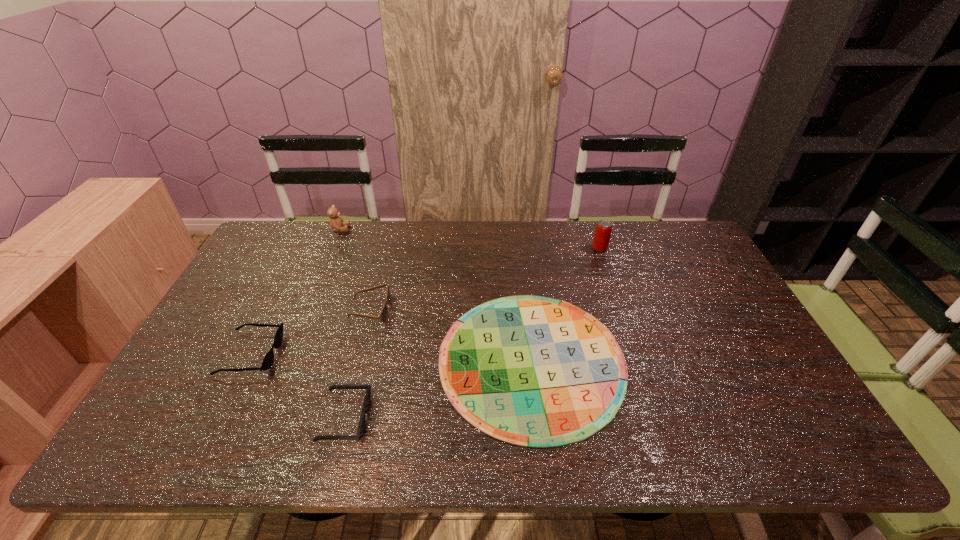
The image size is (960, 540). I want to click on blank area located on the right of the second farthest object, so click(668, 248).

Locate an element on the screen. The height and width of the screenshot is (540, 960). vacant space located on the front-facing side of the teddy bear is located at coordinates (460, 230).

The width and height of the screenshot is (960, 540). Find the location of `vacant space located 0.380m on the frames of the farthest sunglasses`. vacant space located 0.380m on the frames of the farthest sunglasses is located at coordinates (519, 310).

At what (x,y) coordinates should I click in order to perform the action: click on vacant region located on the front-facing side of the second nearest sunglasses. Please return your answer as a coordinate pair (x, y). Looking at the image, I should click on click(296, 354).

I want to click on vacant region located on the front-facing side of the nearest sunglasses, so click(x=539, y=418).

Find the location of `free location located 0.370m on the left of the shortest object`. free location located 0.370m on the left of the shortest object is located at coordinates (298, 360).

Identify the location of beer can that is at the far edge. This screenshot has height=540, width=960. (603, 229).

The width and height of the screenshot is (960, 540). I want to click on teddy bear that is at the far edge, so click(336, 223).

You are a GUI agent. You are given a task and a screenshot of the screen. Output one action in this format:
    pyautogui.click(x=<x>, y=<y>)
    Task: Click on the sunglasses located in the near edge section of the desktop
    Image resolution: width=960 pixels, height=540 pixels.
    Given the screenshot: What is the action you would take?
    pyautogui.click(x=361, y=427)

Find the location of `gameboard located in the near edge section of the desktop`. gameboard located in the near edge section of the desktop is located at coordinates (533, 371).